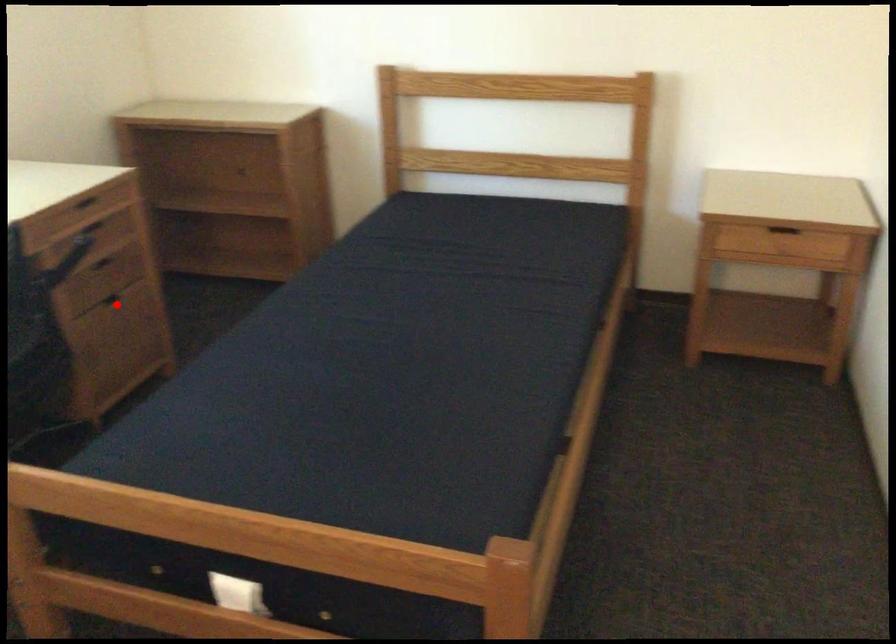
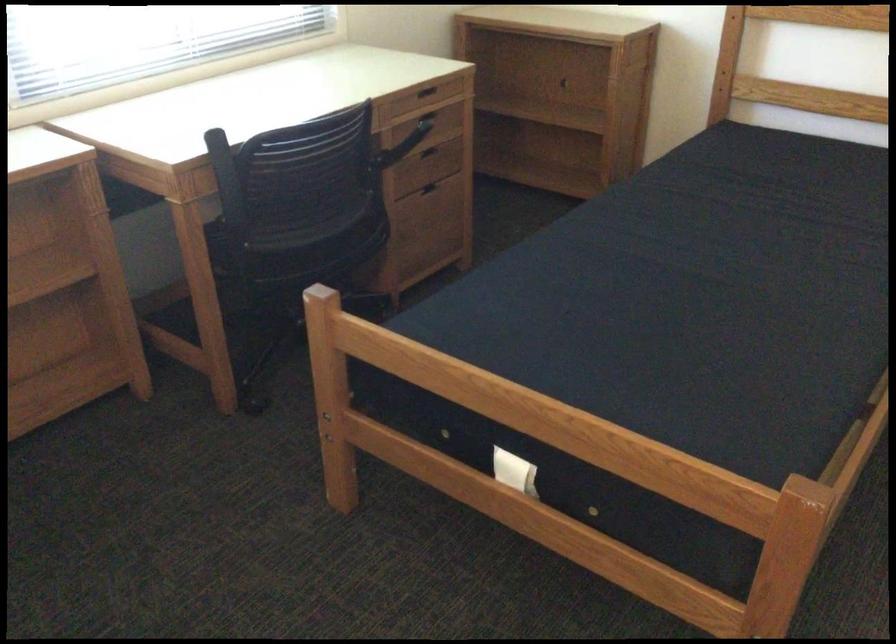
In the second image, find the point that corresponds to the highlighted location in the first image.

(434, 192)